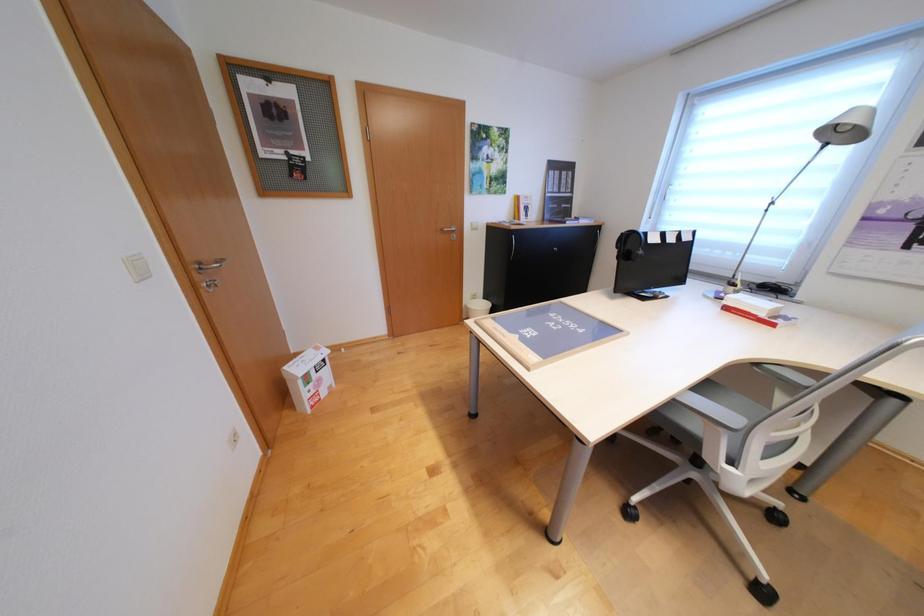
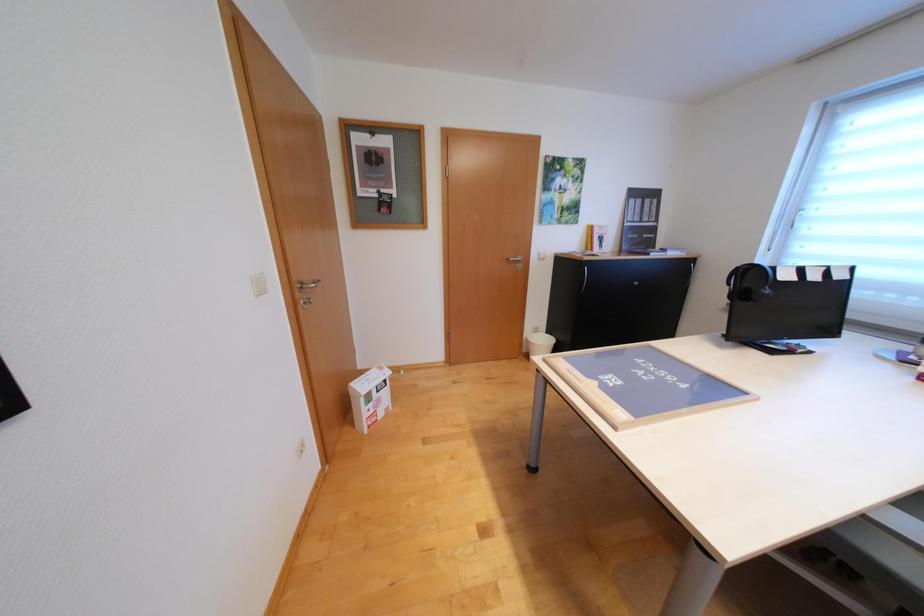
Question: How did the camera likely rotate?

Choices:
 (A) Left
 (B) Right
 (C) Up
 (D) Down

Answer: (A)